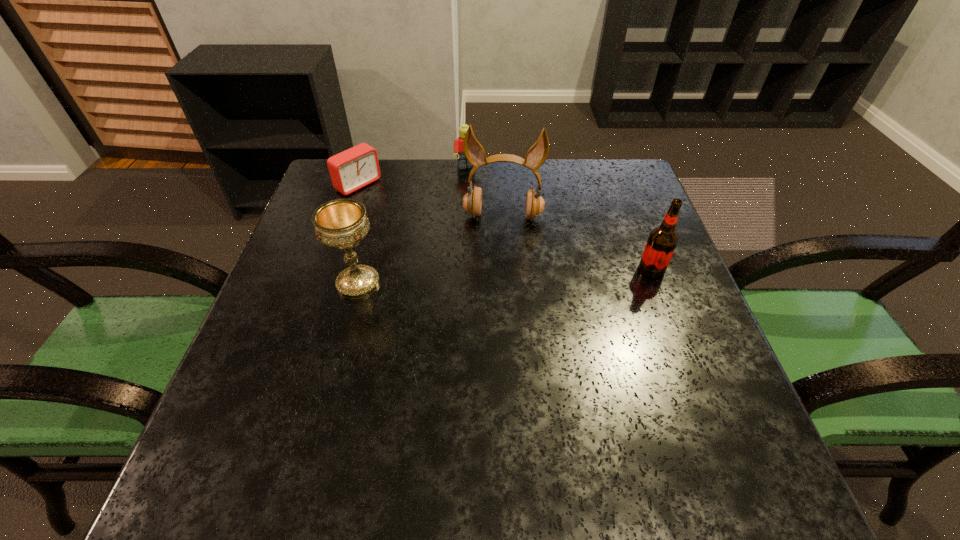
Where is `vacant space located 0.180m on the face of the fourth tallest object`? The image size is (960, 540). vacant space located 0.180m on the face of the fourth tallest object is located at coordinates (489, 210).

Identify the location of vacant point located on the face of the fourth tallest object. (480, 192).

Find the location of a particular element. The image size is (960, 540). free space located 0.120m on the face of the fourth tallest object is located at coordinates (482, 196).

The width and height of the screenshot is (960, 540). I want to click on vacant region located 0.070m on the front-facing side of the alarm clock, so click(388, 205).

Where is `blank space located 0.400m on the front-facing side of the alarm clock`? blank space located 0.400m on the front-facing side of the alarm clock is located at coordinates (477, 265).

Locate an element on the screen. The height and width of the screenshot is (540, 960). vacant space located on the front-facing side of the alarm clock is located at coordinates (404, 216).

Identify the location of vacant area situated on the front-facing side of the tallest object. This screenshot has height=540, width=960. (492, 335).

You are a GUI agent. You are given a task and a screenshot of the screen. Output one action in this format:
    pyautogui.click(x=<x>, y=<y>)
    Task: Click on the vacant position located 0.200m on the front-facing side of the tallest object
    The width and height of the screenshot is (960, 540).
    Given the screenshot: What is the action you would take?
    pyautogui.click(x=495, y=287)

At what (x,y) coordinates should I click in order to perform the action: click on free location located on the front-facing side of the tallest object. Please return your answer as a coordinate pair (x, y). Image resolution: width=960 pixels, height=540 pixels. Looking at the image, I should click on (491, 352).

At what (x,y) coordinates should I click in order to perform the action: click on Lego present at the far edge. Please return your answer as a coordinate pair (x, y). The width and height of the screenshot is (960, 540). Looking at the image, I should click on (462, 163).